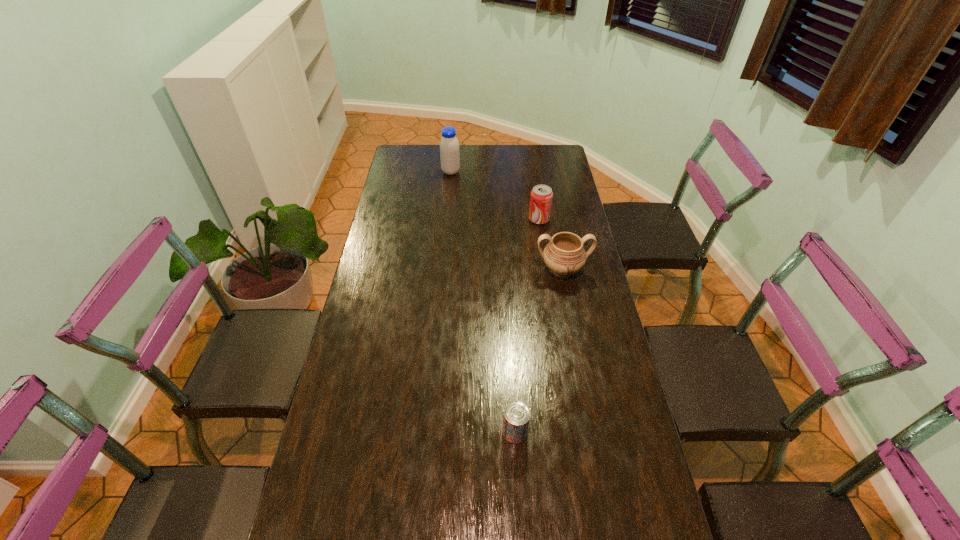
Find the location of a particular element. object that is at the far edge is located at coordinates (449, 146).

Find the location of `urn that is at the right edge`. urn that is at the right edge is located at coordinates (564, 255).

What are the coordinates of `soda can that is at the right edge` in the screenshot? It's located at (541, 197).

Where is `vacant area at the far edge of the desktop`? vacant area at the far edge of the desktop is located at coordinates pyautogui.click(x=516, y=149).

Image resolution: width=960 pixels, height=540 pixels. I want to click on vacant space at the left edge of the desktop, so click(x=367, y=318).

Where is `vacant space at the far left corner`? The width and height of the screenshot is (960, 540). vacant space at the far left corner is located at coordinates (427, 157).

This screenshot has height=540, width=960. Identify the location of vacant region between the soda can and the second object from left to right. (527, 326).

The width and height of the screenshot is (960, 540). I want to click on empty location between the third farthest object and the beer can, so click(539, 351).

The height and width of the screenshot is (540, 960). Identify the location of vacant space that is in between the soda can and the second object from left to right. (527, 326).

This screenshot has width=960, height=540. I want to click on vacant area that lies between the third farthest object and the beer can, so pos(539,351).